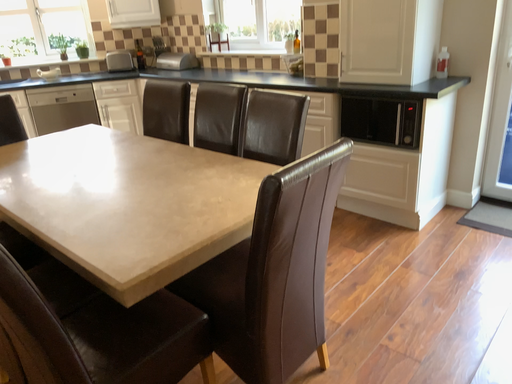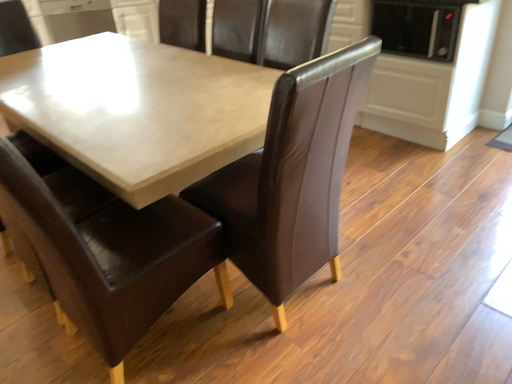
Question: How did the camera likely rotate when shooting the video?

Choices:
 (A) rotated downward
 (B) rotated upward

Answer: (A)